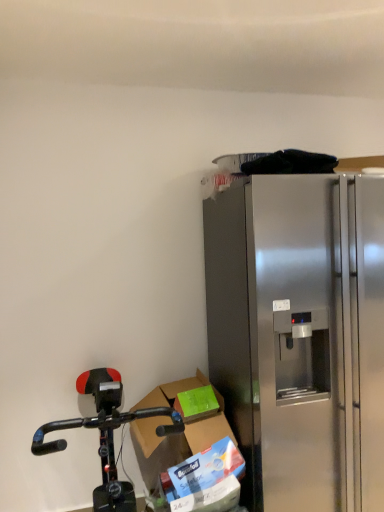
At what (x,y) coordinates should I click in order to perform the action: click on stainless steel refrigerator at right. Please return your answer as a coordinate pair (x, y). Looking at the image, I should click on (300, 336).

What is the approximate width of stainless steel refrigerator at right?

stainless steel refrigerator at right is 32.18 inches in width.

Image resolution: width=384 pixels, height=512 pixels. Describe the element at coordinates (106, 435) in the screenshot. I see `black matte bicycle at lower left` at that location.

This screenshot has width=384, height=512. Identify the location of cardboard box at lower center. (208, 429).

Consider the image. From a real-world perspective, is stainless steel refrigerator at right located higher than cardboard box at lower center?

Correct, in the physical world, stainless steel refrigerator at right is higher than cardboard box at lower center.

Is stainless steel refrigerator at right at the right side of cardboard box at lower center?

Indeed, stainless steel refrigerator at right is positioned on the right side of cardboard box at lower center.

Considering the sizes of objects stainless steel refrigerator at right and cardboard box at lower center in the image provided, who is thinner, stainless steel refrigerator at right or cardboard box at lower center?

cardboard box at lower center is thinner.

Can you tell me how much stainless steel refrigerator at right and cardboard box at lower center differ in facing direction?

There is a 2.34-degree angle between the facing directions of stainless steel refrigerator at right and cardboard box at lower center.

Does stainless steel refrigerator at right lie in front of black matte bicycle at lower left?

No, stainless steel refrigerator at right is behind black matte bicycle at lower left.

Can you confirm if stainless steel refrigerator at right is thinner than black matte bicycle at lower left?

Yes.

Does stainless steel refrigerator at right appear on the right side of black matte bicycle at lower left?

Yes, stainless steel refrigerator at right is to the right of black matte bicycle at lower left.

What's the angular difference between stainless steel refrigerator at right and black matte bicycle at lower left's facing directions?

stainless steel refrigerator at right and black matte bicycle at lower left are facing 2.34 degrees away from each other.

Is cardboard box at lower center thinner than stainless steel refrigerator at right?

Indeed, cardboard box at lower center has a lesser width compared to stainless steel refrigerator at right.

Between cardboard box at lower center and stainless steel refrigerator at right, which one has less height?

cardboard box at lower center.

Is cardboard box at lower center at the left side of stainless steel refrigerator at right?

Correct, you'll find cardboard box at lower center to the left of stainless steel refrigerator at right.

From the picture: From the image's perspective, who appears lower, cardboard box at lower center or stainless steel refrigerator at right?

From the image's view, cardboard box at lower center is below.

From a real-world perspective, which object stands above the other?

cardboard box at lower center, from a real-world perspective.

Is black matte bicycle at lower left inside the boundaries of cardboard box at lower center, or outside?

black matte bicycle at lower left cannot be found inside cardboard box at lower center.

Considering the sizes of black matte bicycle at lower left and cardboard box at lower center in the image, is black matte bicycle at lower left wider or thinner than cardboard box at lower center?

Considering their sizes, black matte bicycle at lower left looks broader than cardboard box at lower center.

Who is taller, black matte bicycle at lower left or cardboard box at lower center?

black matte bicycle at lower left.

Is black matte bicycle at lower left inside or outside of stainless steel refrigerator at right?

black matte bicycle at lower left is located beyond the bounds of stainless steel refrigerator at right.

Based on the photo, from the image's perspective, between black matte bicycle at lower left and stainless steel refrigerator at right, who is located below?

black matte bicycle at lower left appears lower in the image.

Can you confirm if black matte bicycle at lower left is positioned to the left of stainless steel refrigerator at right?

Indeed, black matte bicycle at lower left is positioned on the left side of stainless steel refrigerator at right.

Can you tell me how much cardboard box at lower center and black matte bicycle at lower left differ in facing direction?

There is a 0.00123-degree angle between the facing directions of cardboard box at lower center and black matte bicycle at lower left.

Is cardboard box at lower center completely or partially outside of black matte bicycle at lower left?

That's incorrect, cardboard box at lower center is not completely outside black matte bicycle at lower left.

Is cardboard box at lower center beside black matte bicycle at lower left?

No, cardboard box at lower center is not touching black matte bicycle at lower left.

From their relative heights in the image, would you say cardboard box at lower center is taller or shorter than black matte bicycle at lower left?

Considering their sizes, cardboard box at lower center has less height than black matte bicycle at lower left.

Identify the location of refrigerator located above the cardboard box at lower center (from a real-world perspective). The image size is (384, 512). (300, 336).

Find the location of `refrigerator on the right side of black matte bicycle at lower left`. refrigerator on the right side of black matte bicycle at lower left is located at coordinates (x=300, y=336).

Based on the photo, which object lies further to the anchor point black matte bicycle at lower left, stainless steel refrigerator at right or cardboard box at lower center?

Based on the image, stainless steel refrigerator at right appears to be further to black matte bicycle at lower left.

Based on their spatial positions, is stainless steel refrigerator at right or black matte bicycle at lower left closer to cardboard box at lower center?

black matte bicycle at lower left is positioned closer to the anchor cardboard box at lower center.

When comparing their distances from stainless steel refrigerator at right, does cardboard box at lower center or black matte bicycle at lower left seem further?

black matte bicycle at lower left is further to stainless steel refrigerator at right.

Considering their positions, is black matte bicycle at lower left positioned further to stainless steel refrigerator at right than cardboard box at lower center?

The object further to stainless steel refrigerator at right is black matte bicycle at lower left.

When comparing their distances from cardboard box at lower center, does black matte bicycle at lower left or stainless steel refrigerator at right seem further?

The object further to cardboard box at lower center is stainless steel refrigerator at right.

From the image, which object appears to be farther from black matte bicycle at lower left, cardboard box at lower center or stainless steel refrigerator at right?

stainless steel refrigerator at right is positioned further to the anchor black matte bicycle at lower left.

Find the location of a particular element. The width and height of the screenshot is (384, 512). box situated between black matte bicycle at lower left and stainless steel refrigerator at right from left to right is located at coordinates (208, 429).